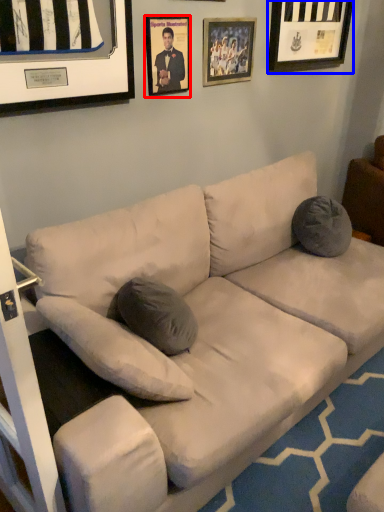
Question: Which object appears closest to the camera in this image, picture frame (highlighted by a red box) or picture frame (highlighted by a blue box)?

Choices:
 (A) picture frame
 (B) picture frame

Answer: (A)